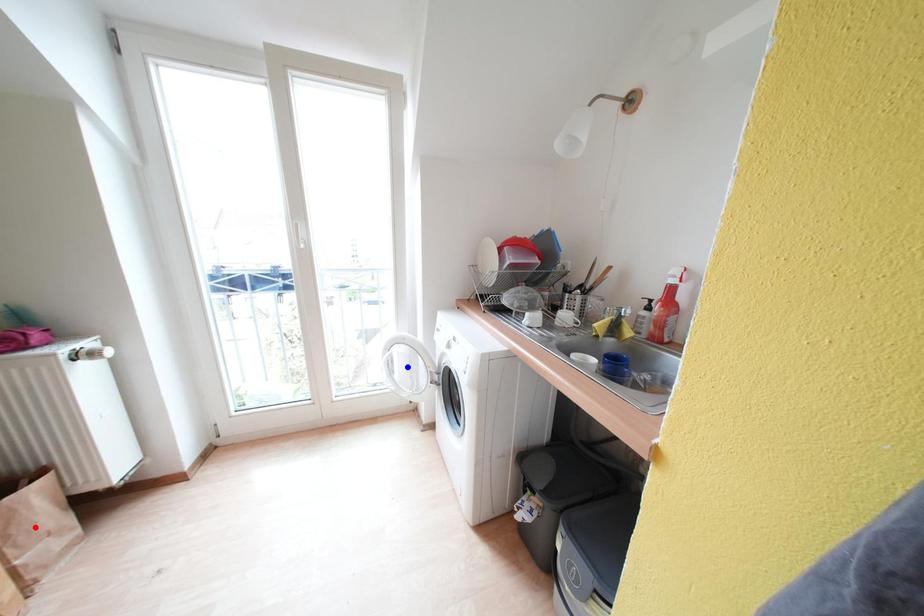
Question: In the image, two points are highlighted. Which point is nearer to the camera? Reply with the corresponding letter.

Choices:
 (A) blue point
 (B) red point

Answer: (B)